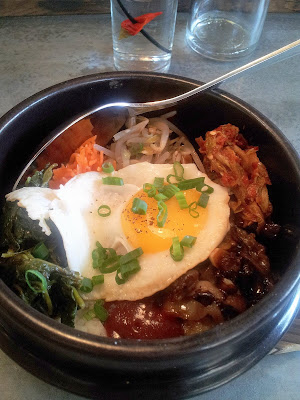
Locate an element on the screen. The width and height of the screenshot is (300, 400). water in glass is located at coordinates (159, 27).